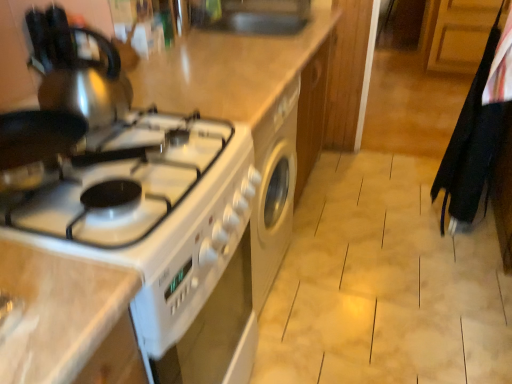
Question: Considering the relative sizes of white glossy gas stove at left and black fabric laundry at right in the image provided, is white glossy gas stove at left smaller than black fabric laundry at right?

Choices:
 (A) yes
 (B) no

Answer: (A)

Question: From the image's perspective, is white glossy gas stove at left located above black fabric laundry at right?

Choices:
 (A) yes
 (B) no

Answer: (B)

Question: Would you say white glossy gas stove at left is a long distance from black fabric laundry at right?

Choices:
 (A) yes
 (B) no

Answer: (A)

Question: Is white glossy gas stove at left surrounding black fabric laundry at right?

Choices:
 (A) yes
 (B) no

Answer: (B)

Question: Is white glossy gas stove at left not inside black fabric laundry at right?

Choices:
 (A) no
 (B) yes

Answer: (B)

Question: Is black fabric laundry at right at the back of white glossy gas stove at left?

Choices:
 (A) no
 (B) yes

Answer: (A)

Question: Considering the relative sizes of satin silver kettle at upper left and black fabric laundry at right in the image provided, is satin silver kettle at upper left taller than black fabric laundry at right?

Choices:
 (A) no
 (B) yes

Answer: (A)

Question: Could black fabric laundry at right be considered to be inside satin silver kettle at upper left?

Choices:
 (A) no
 (B) yes

Answer: (A)

Question: Considering the relative sizes of satin silver kettle at upper left and black fabric laundry at right in the image provided, is satin silver kettle at upper left shorter than black fabric laundry at right?

Choices:
 (A) no
 (B) yes

Answer: (B)

Question: From a real-world perspective, is satin silver kettle at upper left positioned over black fabric laundry at right based on gravity?

Choices:
 (A) no
 (B) yes

Answer: (B)

Question: Is satin silver kettle at upper left turned away from black fabric laundry at right?

Choices:
 (A) no
 (B) yes

Answer: (A)

Question: Is satin silver kettle at upper left not near black fabric laundry at right?

Choices:
 (A) no
 (B) yes

Answer: (B)

Question: Is satin silver kettle at upper left a part of white glossy stove at left?

Choices:
 (A) yes
 (B) no

Answer: (B)